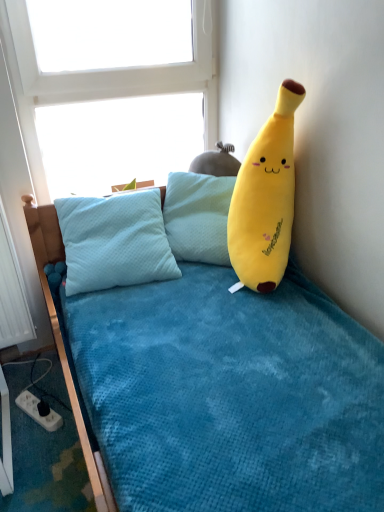
Question: Looking at their shapes, would you say white plastic power outlet at lower left is wider or thinner than soft yellow plush banana at upper right?

Choices:
 (A) thin
 (B) wide

Answer: (A)

Question: Would you say white plastic power outlet at lower left is to the left or to the right of soft yellow plush banana at upper right in the picture?

Choices:
 (A) right
 (B) left

Answer: (B)

Question: Estimate the real-world distances between objects in this image. Which object is farther from the soft yellow plush banana at upper right?

Choices:
 (A) transparent glass window at upper center
 (B) white plastic power outlet at lower left

Answer: (B)

Question: Which object is positioned farthest from the soft yellow plush banana at upper right?

Choices:
 (A) white plastic power outlet at lower left
 (B) transparent glass window at upper center

Answer: (A)